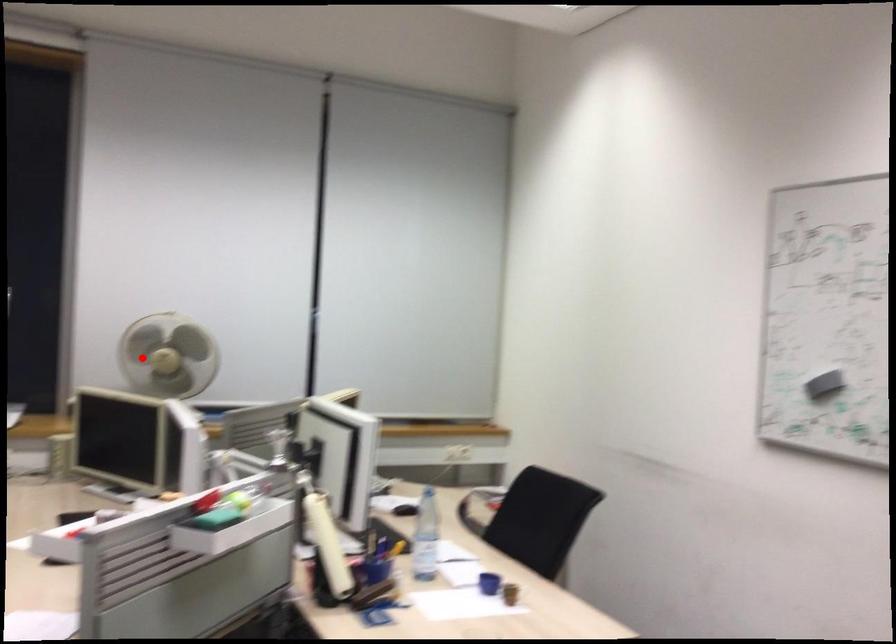
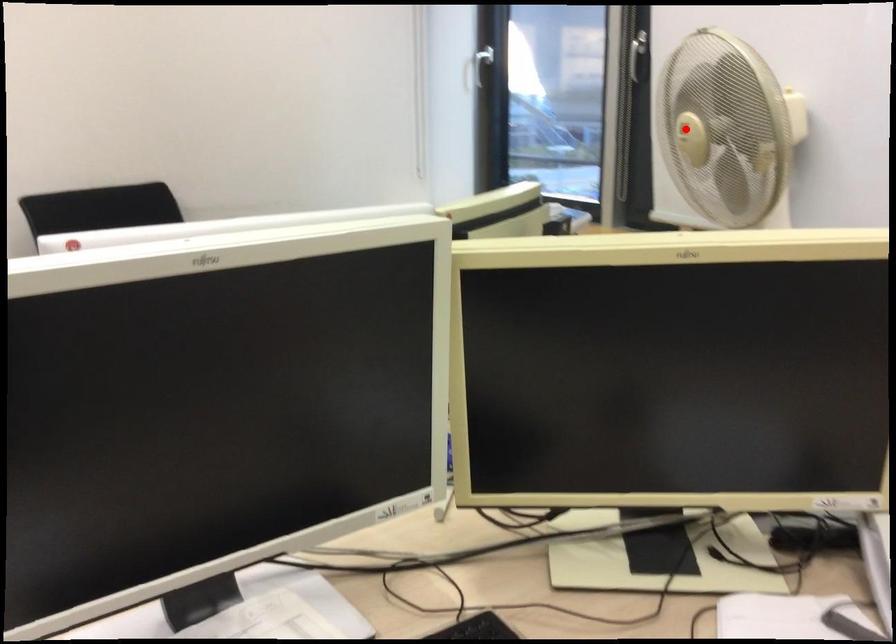
I am providing you with two images of the same scene from different viewpoints. A red point is marked on the first image and another point is marked on the second image. Are the points marked in image1 and image2 representing the same 3D position?

Yes